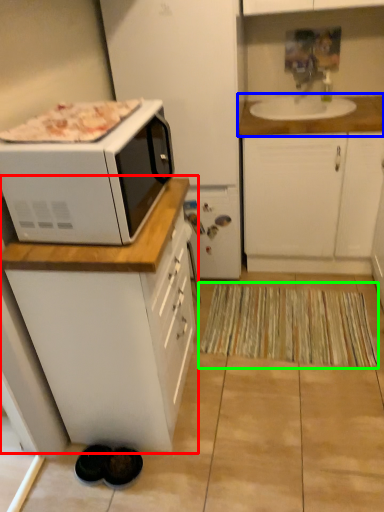
Question: Based on their relative distances, which object is nearer to cabinetry (highlighted by a red box)? Choose from countertop (highlighted by a blue box) and mat (highlighted by a green box).

Choices:
 (A) countertop
 (B) mat

Answer: (B)